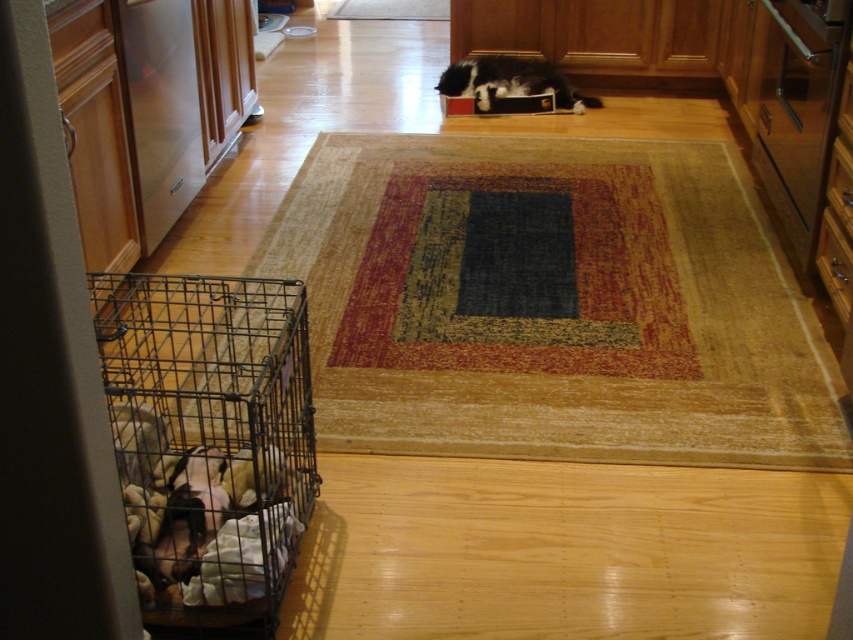
You are standing in the room and want to place a small plant pot at the point marked as point (207, 442). Would placing the plant pot there block access to the metal wire cage at lower left?

The point (207, 442) is on the metal wire cage at lower left, so placing the plant pot there would block access to the metal wire cage at lower left.

You are standing in the center of the room and want to place a new plant pot exactly where the metal wire cage at lower left is currently located. What are the coordinates where you should place the plant pot?

The coordinates for the metal wire cage at lower left are at point (207, 442). Therefore, you should place the plant pot at coordinates (207, 442).